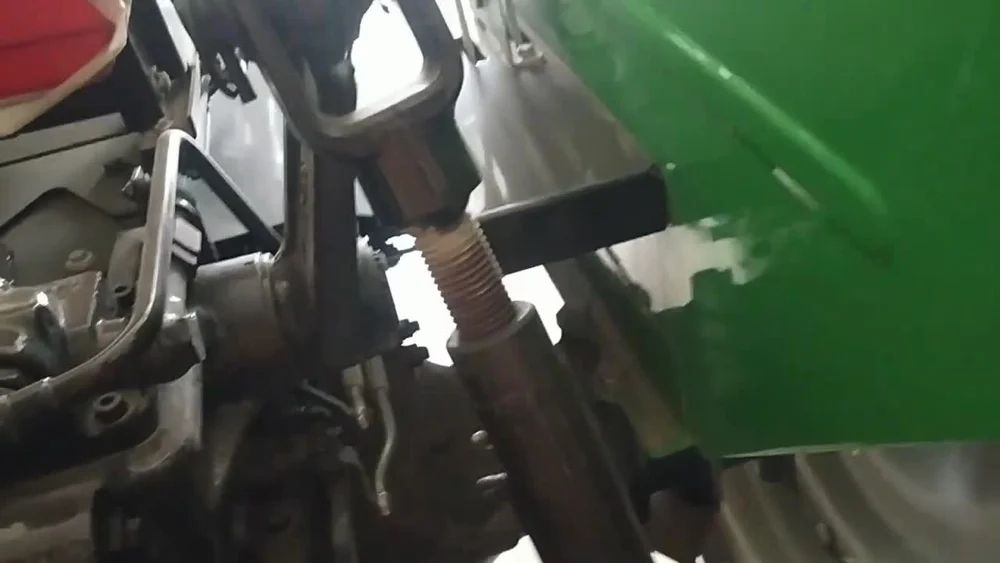
This screenshot has height=563, width=1000. In order to click on door handle in this screenshot , I will do `click(526, 51)`.